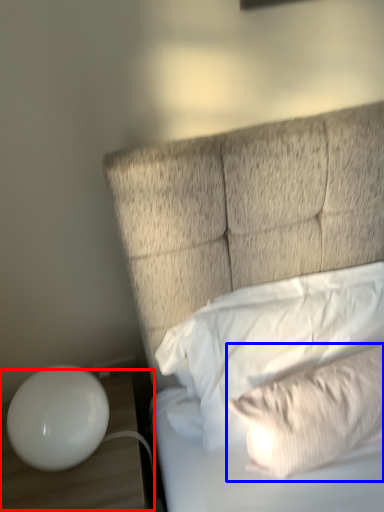
Question: Which point is further to the camera, table (highlighted by a red box) or pillow (highlighted by a blue box)?

Choices:
 (A) table
 (B) pillow

Answer: (A)